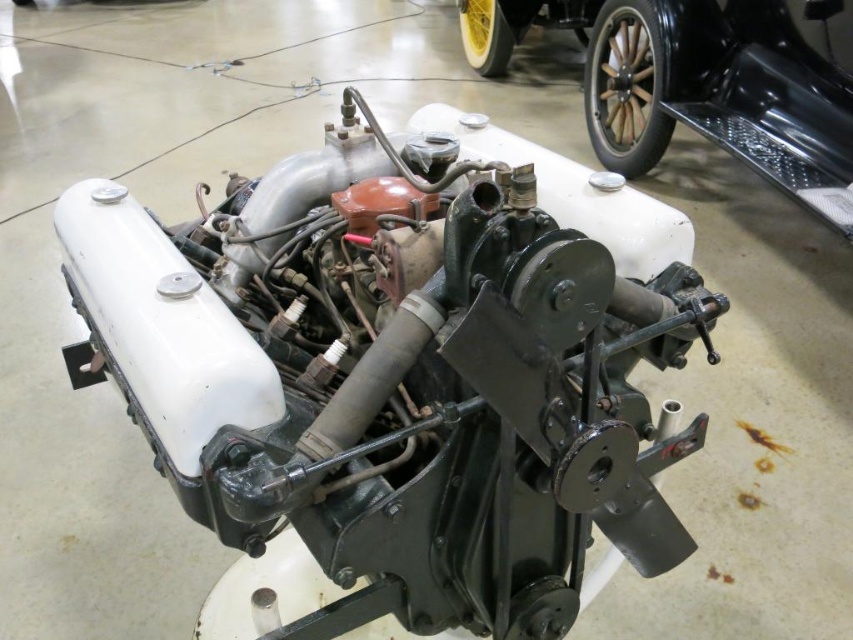
Question: Is matte black engine at center positioned behind metallic black engine at center?

Choices:
 (A) yes
 (B) no

Answer: (B)

Question: Which of the following is the farthest from the observer?

Choices:
 (A) matte black engine at center
 (B) metallic black engine at center

Answer: (B)

Question: Which of the following is the closest to the observer?

Choices:
 (A) (811, 144)
 (B) (347, 516)

Answer: (B)

Question: In this image, where is matte black engine at center located relative to metallic black engine at center?

Choices:
 (A) right
 (B) left

Answer: (B)

Question: Does matte black engine at center have a smaller size compared to metallic black engine at center?

Choices:
 (A) yes
 (B) no

Answer: (A)